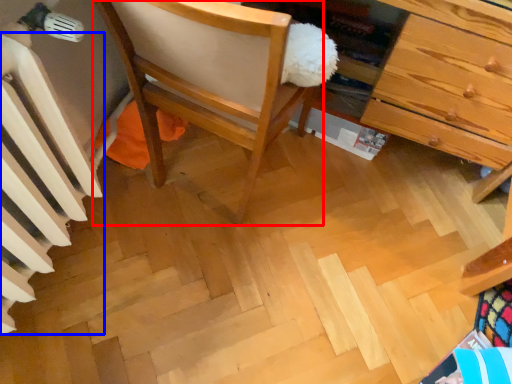
Question: Which of the following is the farthest to the observer, chair (highlighted by a red box) or radiator (highlighted by a blue box)?

Choices:
 (A) chair
 (B) radiator

Answer: (A)